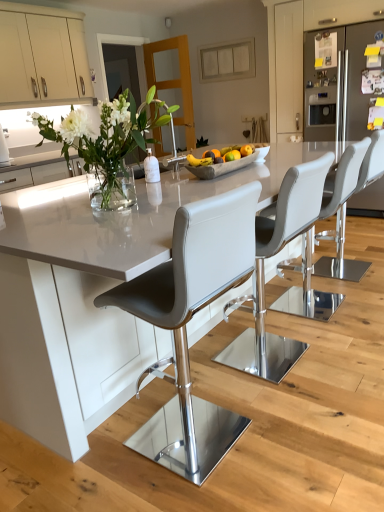
Find the location of a particular element. free space between gray leather stool at center, the 2th chair from the back, and white leather bar stool at center, which is the second chair in front-to-back order is located at coordinates (304, 329).